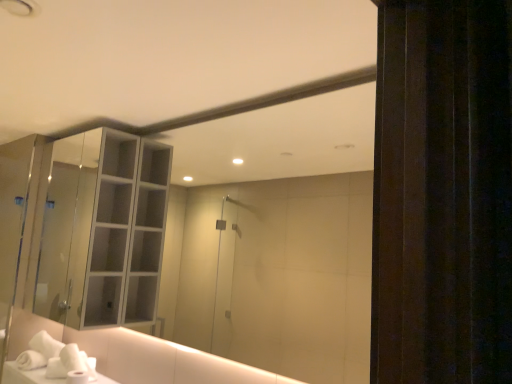
Question: Considering the positions of point (58, 147) and point (95, 374), is point (58, 147) closer or farther from the camera than point (95, 374)?

Choices:
 (A) closer
 (B) farther

Answer: (B)

Question: Is clear glass cabinet at upper left situated inside white soft hand towel at lower left or outside?

Choices:
 (A) outside
 (B) inside

Answer: (A)

Question: Considering their positions, is clear glass cabinet at upper left located in front of or behind white soft hand towel at lower left?

Choices:
 (A) behind
 (B) front

Answer: (B)

Question: Considering the positions of white soft hand towel at lower left and clear glass cabinet at upper left in the image, is white soft hand towel at lower left bigger or smaller than clear glass cabinet at upper left?

Choices:
 (A) small
 (B) big

Answer: (A)

Question: Is point (87, 359) closer or farther from the camera than point (101, 304)?

Choices:
 (A) farther
 (B) closer

Answer: (B)

Question: From their relative heights in the image, would you say white soft hand towel at lower left is taller or shorter than clear glass cabinet at upper left?

Choices:
 (A) short
 (B) tall

Answer: (A)

Question: From a real-world perspective, is white soft hand towel at lower left above or below clear glass cabinet at upper left?

Choices:
 (A) above
 (B) below

Answer: (B)